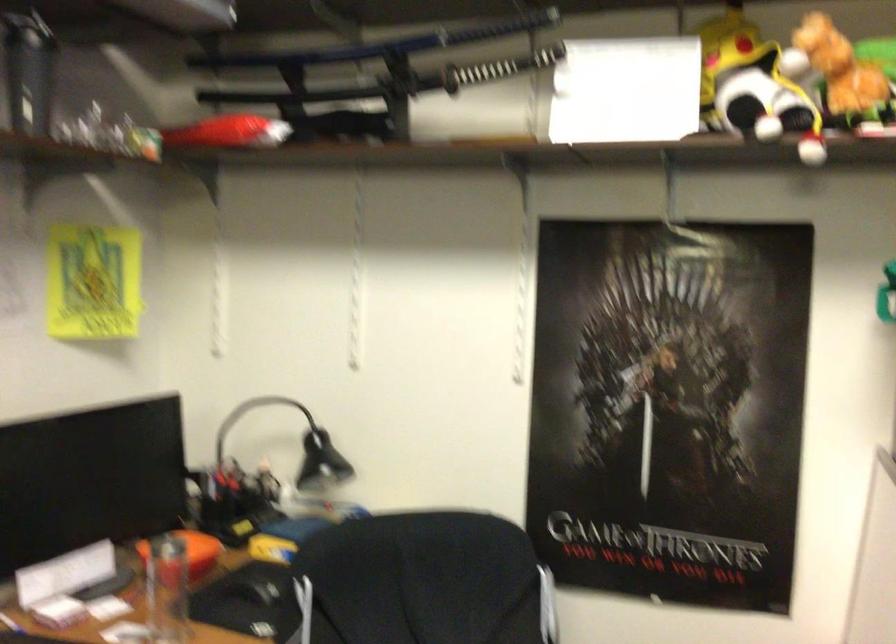
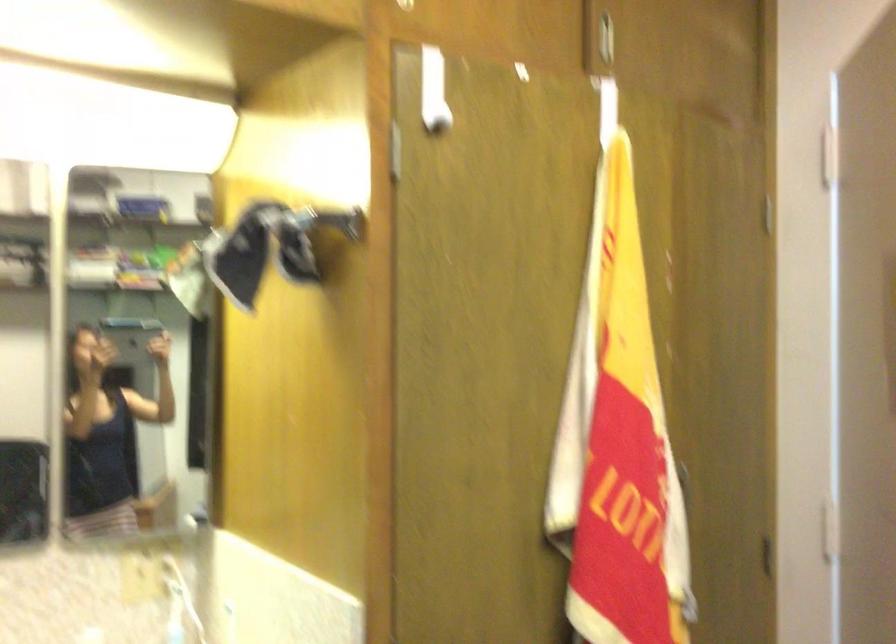
Question: The camera is either moving clockwise (left) or counter-clockwise (right) around the object. The first image is from the beginning of the video and the second image is from the end. Is the camera moving left or right when shooting the video?

Choices:
 (A) Left
 (B) Right

Answer: (B)